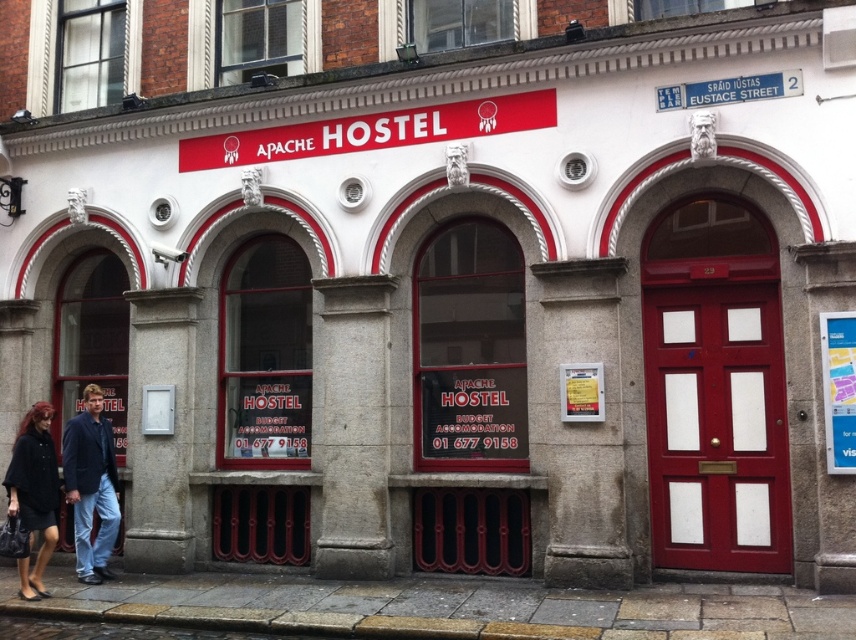
In the scene shown: You are a delivery person trying to leave a package at the Apache Hostel. You see the blue denim jeans at lower left and the black fabric coat at lower left near the entrance. Which item is closer to the entrance?

The blue denim jeans at lower left is closer to the entrance because the black fabric coat at lower left is behind it.

You are a delivery person trying to place a package on the ground near the Apache Hostel entrance. The package must be placed between the blue denim jeans at lower left and the black fabric coat at lower left. However, you need to ensure that the package is placed on the side of the taller object. Which object should you place the package next to?

The blue denim jeans at lower left is much taller than the black fabric coat at lower left, so you should place the package next to the blue denim jeans at lower left.

You are standing in front of the Apache Hostel building and want to walk to the brown stone pavement at lower center. According to the image, where exactly should you walk to reach it?

The brown stone pavement at lower center is located at the coordinates point (441, 605), so you should walk towards that specific point to reach it.